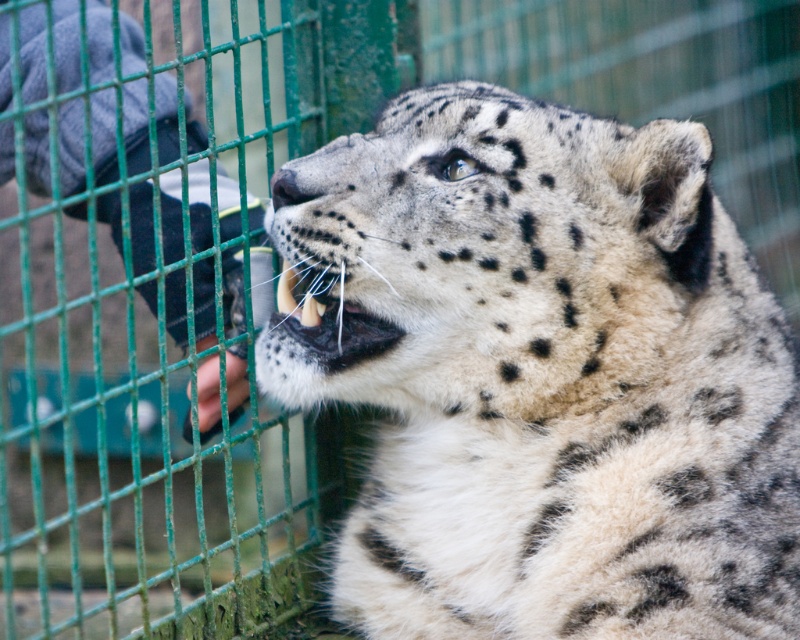
Question: Can you confirm if spotted fur cheetah at center is thinner than denim glove at left?

Choices:
 (A) yes
 (B) no

Answer: (B)

Question: Is spotted fur cheetah at center to the left of white fur at center from the viewer's perspective?

Choices:
 (A) yes
 (B) no

Answer: (B)

Question: Estimate the real-world distances between objects in this image. Which object is closer to the white fur at center?

Choices:
 (A) spotted fur cheetah at center
 (B) denim glove at left

Answer: (A)

Question: Which point is closer to the camera?

Choices:
 (A) denim glove at left
 (B) white fur at center
 (C) spotted fur cheetah at center

Answer: (C)

Question: Estimate the real-world distances between objects in this image. Which object is farther from the white fur at center?

Choices:
 (A) denim glove at left
 (B) spotted fur cheetah at center

Answer: (A)

Question: From the image, what is the correct spatial relationship of spotted fur cheetah at center in relation to denim glove at left?

Choices:
 (A) right
 (B) left

Answer: (A)